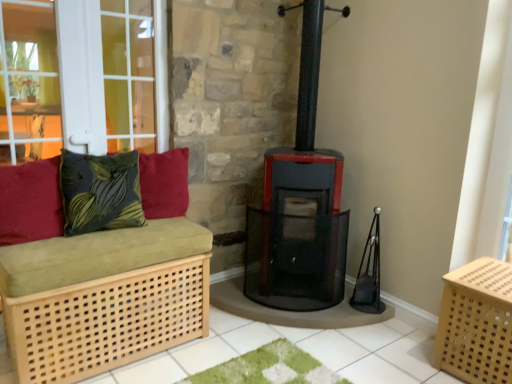
Question: From the image's perspective, is light wood/canvassed crate at lower right positioned above or below green leafy fabric cushion at left, the 2th pillow when ordered from right to left?

Choices:
 (A) above
 (B) below

Answer: (B)

Question: Is light wood/canvassed crate at lower right taller or shorter than green leafy fabric cushion at left, positioned as the 2th pillow in left-to-right order?

Choices:
 (A) tall
 (B) short

Answer: (A)

Question: Which of these objects is positioned closest to the green leafy fabric cushion at left, the 2th pillow when ordered from right to left?

Choices:
 (A) light wood/canvassed crate at lower right
 (B) velvety red cushion at left, placed as the 1th pillow when sorted from left to right
 (C) light wood/light brown bench at left
 (D) velvety red cushion at upper left, which ranks as the third pillow in left-to-right order

Answer: (B)

Question: Based on their relative distances, which object is farther from the velvety red cushion at left, placed as the 1th pillow when sorted from left to right?

Choices:
 (A) green leafy fabric cushion at left, positioned as the 2th pillow in left-to-right order
 (B) light wood/canvassed crate at lower right
 (C) velvety red cushion at upper left, which ranks as the third pillow in left-to-right order
 (D) light wood/light brown bench at left

Answer: (B)